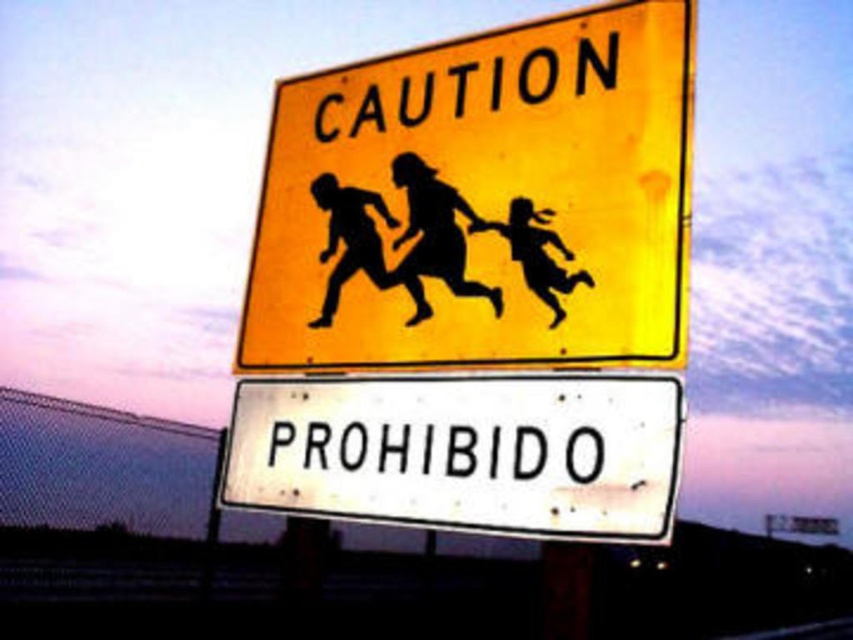
You are a delivery driver who needs to attach a small package to the pole holding the yellow matte caution sign at upper center and the white matte sign at center. The package requires 10 inches of space between the two signs to be placed safely. Can you fit the package between them?

The yellow matte caution sign at upper center is 12.35 inches away from the white matte sign at center. Since the required space is 10 inches, the package can be safely placed between them as there is enough space.

You are standing at the base of the pole holding the two road signs. You notice two points marked on the pole at coordinates point (660,365) and point (480,468). Which point is closer to you?

Point (660,365) is in front of point (480,468), so it is closer to you.

You are a delivery driver who needs to photograph both the yellow matte caution sign at upper center and the white matte sign at center for a report. Your camera can only capture one sign at a time. Based on their widths, which sign should you photograph first to ensure both are fully visible in separate shots?

The yellow matte caution sign at upper center might be wider than white matte sign at center, so you should photograph the yellow matte caution sign at upper center first to ensure it fits within the camera frame before capturing the narrower white matte sign at center.